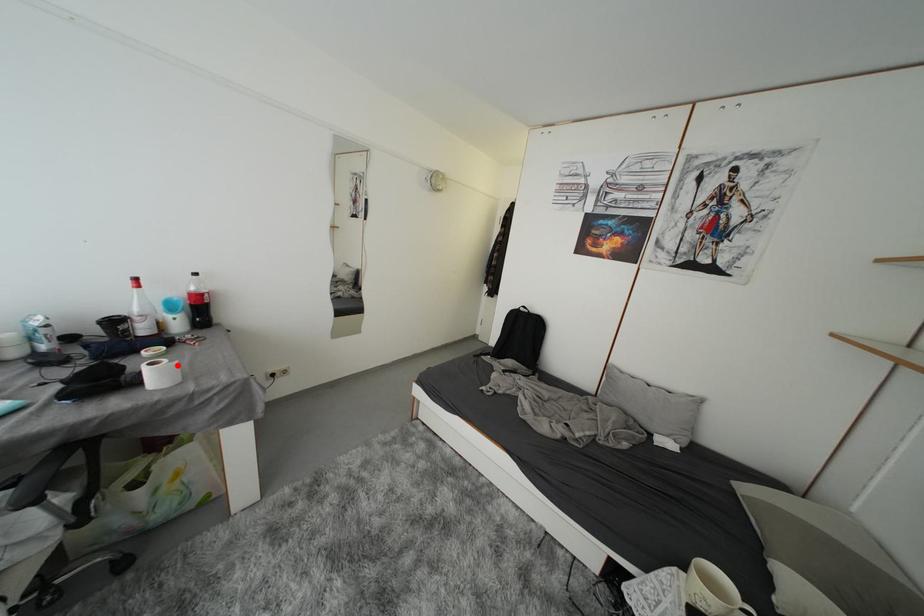
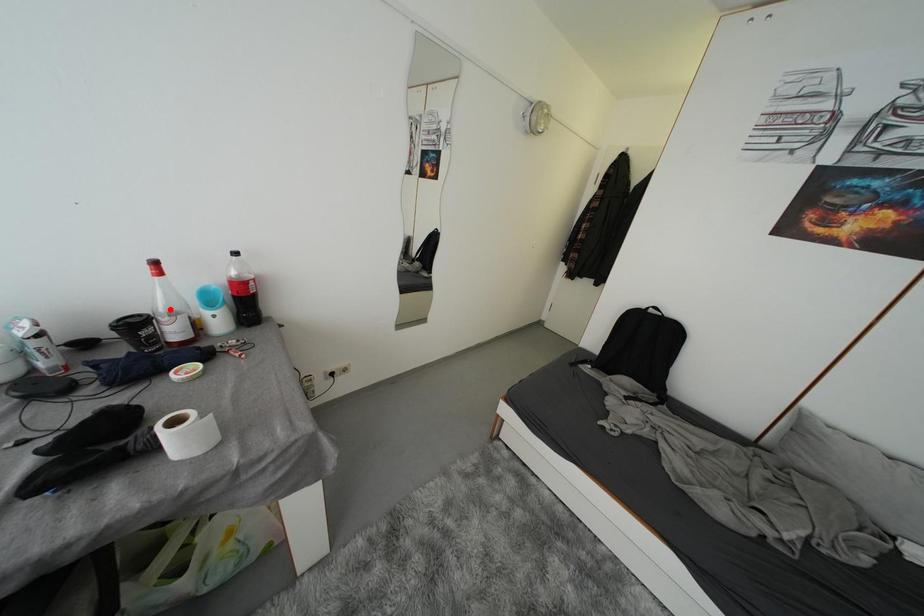
I am providing you with two images of the same scene from different viewpoints. A red point is marked on the first image and another point is marked on the second image. Are the points marked in image1 and image2 representing the same 3D position?

No